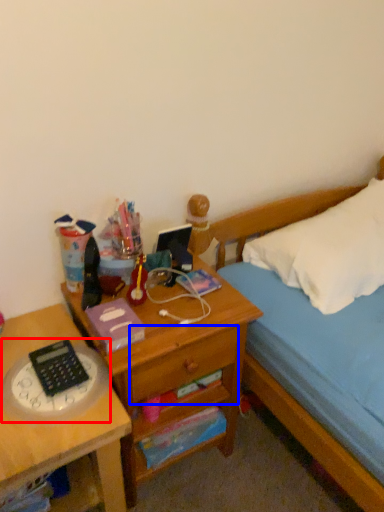
Question: Which of the following is the farthest to the observer, clock (highlighted by a red box) or drawer (highlighted by a blue box)?

Choices:
 (A) clock
 (B) drawer

Answer: (B)